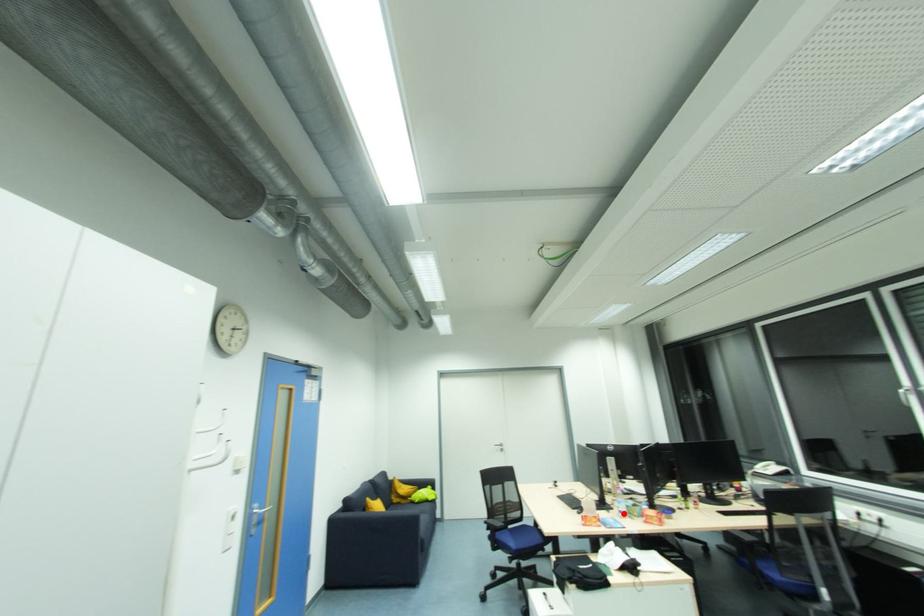
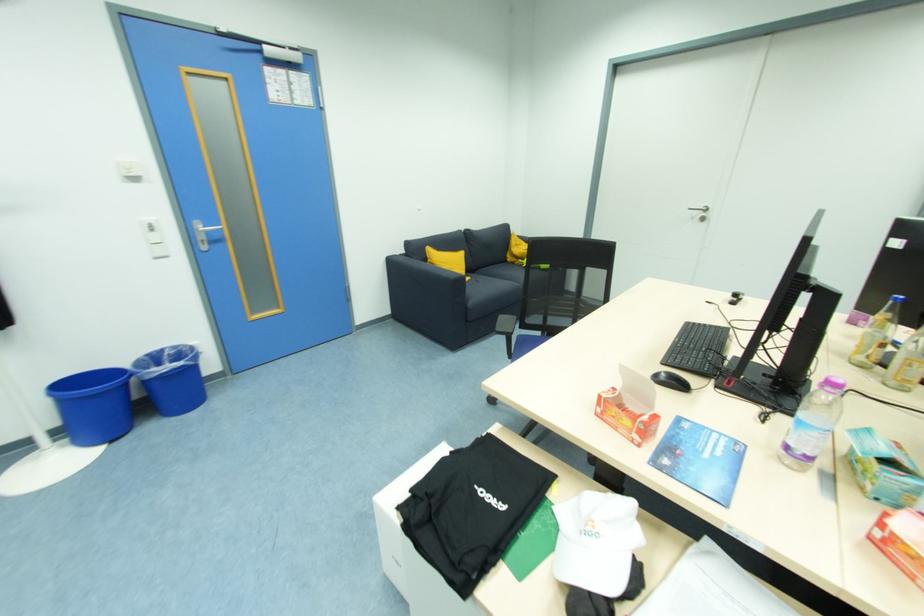
Locate, in the second image, the point that corresponds to the highlighted location in the first image.

(792, 448)